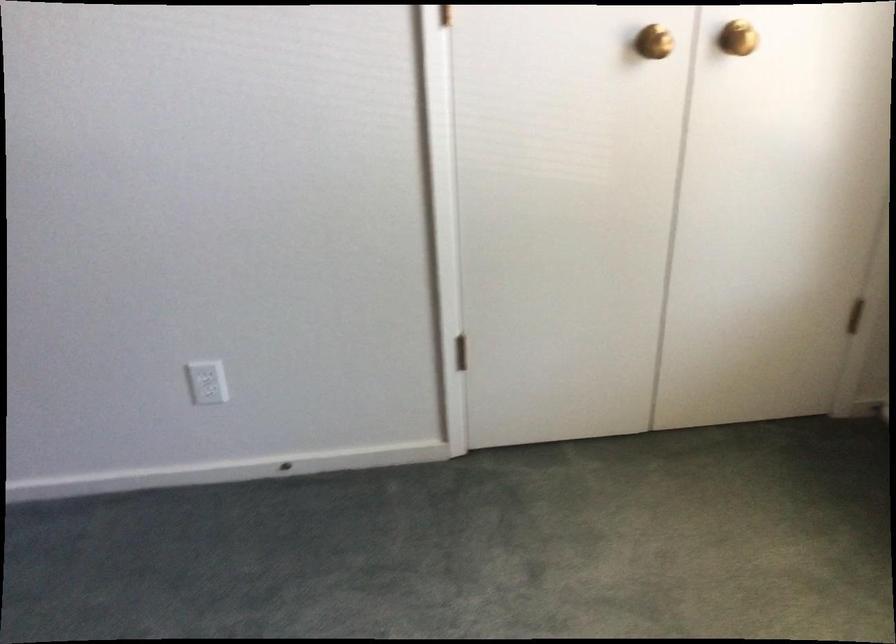
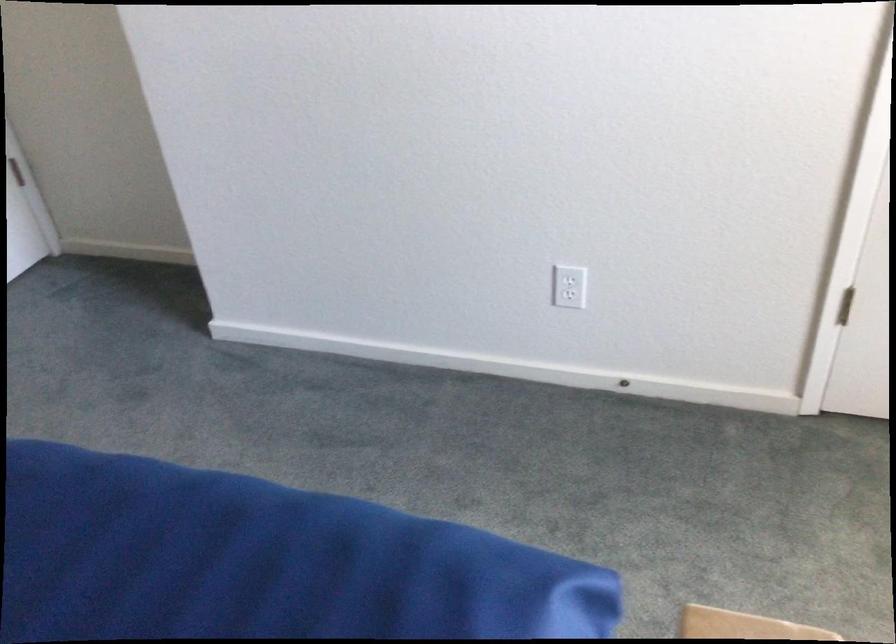
The point at (202,377) is marked in the first image. Where is the corresponding point in the second image?

(570, 279)